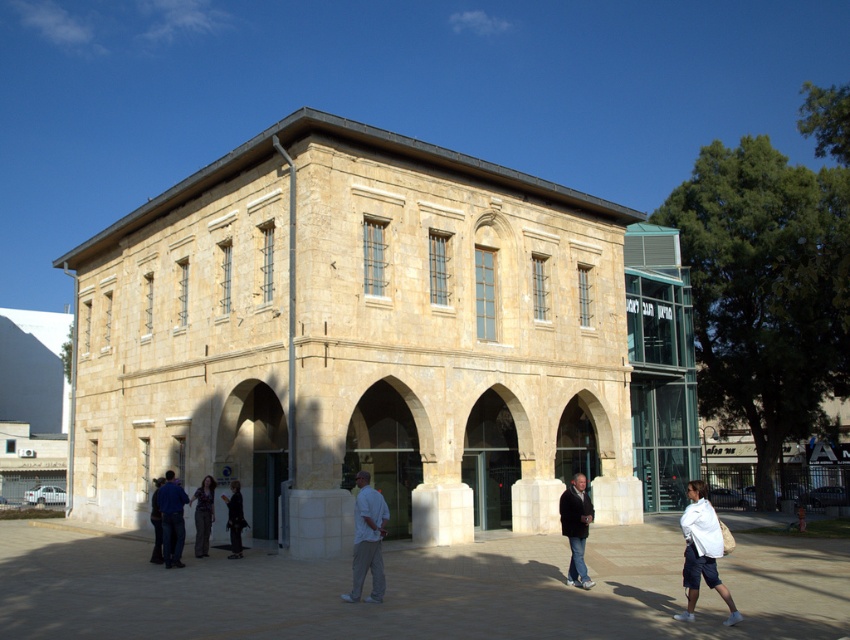
Does white cotton shirt at center lie in front of denim pants at lower left?

Yes, white cotton shirt at center is closer to the viewer.

Image resolution: width=850 pixels, height=640 pixels. What do you see at coordinates (367, 540) in the screenshot?
I see `white cotton shirt at center` at bounding box center [367, 540].

Where is `white cotton shirt at center`? The image size is (850, 640). white cotton shirt at center is located at coordinates (367, 540).

Is blue denim jacket at lower left thinner than denim pants at lower left?

Incorrect, blue denim jacket at lower left's width is not less than denim pants at lower left's.

What do you see at coordinates (171, 518) in the screenshot?
I see `blue denim jacket at lower left` at bounding box center [171, 518].

The image size is (850, 640). I want to click on blue denim jacket at lower left, so pyautogui.click(x=171, y=518).

Is point (199, 490) positioned before point (234, 499)?

Yes, it is in front of point (234, 499).

Describe the element at coordinates (204, 515) in the screenshot. The height and width of the screenshot is (640, 850). I see `denim pants at lower left` at that location.

Who is more distant from viewer, (202, 492) or (238, 492)?

Positioned behind is point (238, 492).

Locate an element on the screen. This screenshot has height=640, width=850. denim pants at lower left is located at coordinates (204, 515).